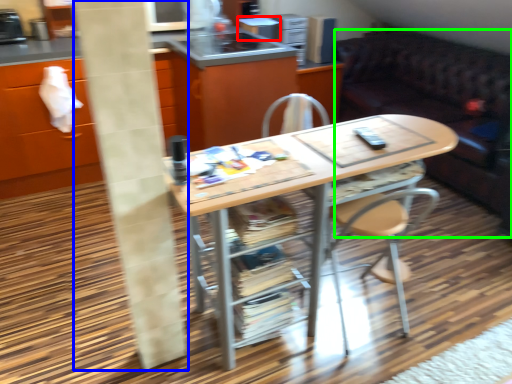
Question: Which object is the closest to the appliance (highlighted by a red box)? Choose among these: pillar (highlighted by a blue box) or studio couch (highlighted by a green box).

Choices:
 (A) pillar
 (B) studio couch

Answer: (B)